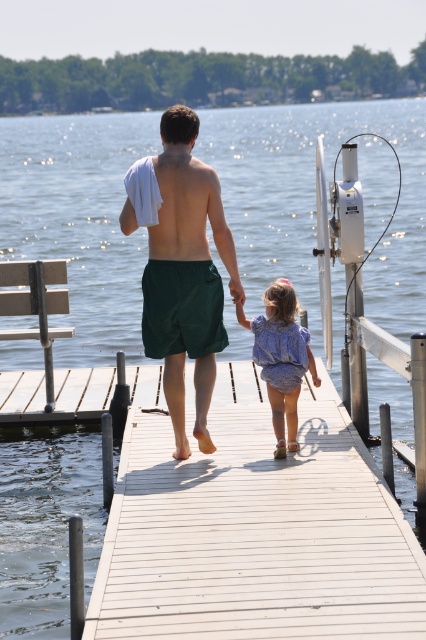
How distant is white wooden dock at center from green fabric shorts at center?

white wooden dock at center is 1.33 meters from green fabric shorts at center.

Is point (221, 557) farther from camera compared to point (207, 358)?

No.

Image resolution: width=426 pixels, height=640 pixels. Find the location of `white wooden dock at center`. white wooden dock at center is located at coordinates (256, 531).

Is point (218, 298) less distant than point (270, 285)?

That is True.

Is green fabric shorts at center behind blue cotton dress at center?

No, green fabric shorts at center is in front of blue cotton dress at center.

Between point (199, 356) and point (293, 384), which one is positioned behind?

The point (293, 384) is behind.

Locate an element on the screen. The image size is (426, 640). green fabric shorts at center is located at coordinates (186, 275).

Which is more to the left, white wooden dock at center or blue cotton dress at center?

white wooden dock at center

Can you confirm if white wooden dock at center is positioned to the right of blue cotton dress at center?

No, white wooden dock at center is not to the right of blue cotton dress at center.

Describe the element at coordinates (256, 531) in the screenshot. I see `white wooden dock at center` at that location.

Locate an element on the screen. The width and height of the screenshot is (426, 640). white wooden dock at center is located at coordinates tap(256, 531).